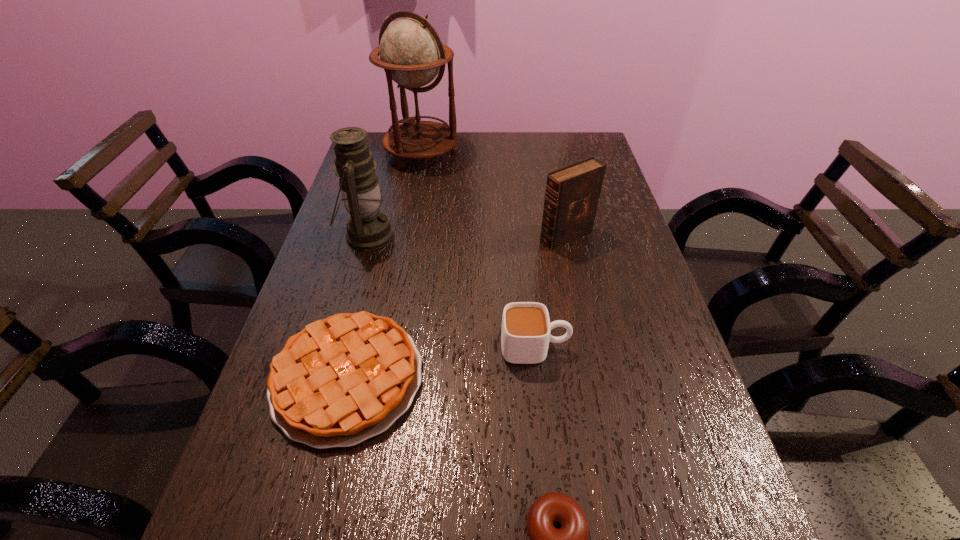
The image size is (960, 540). Find the location of `globe`. globe is located at coordinates (411, 53).

Where is `the farthest object`? the farthest object is located at coordinates (411, 53).

I want to click on the fifth shortest object, so click(368, 228).

Locate an element on the screen. Image resolution: width=960 pixels, height=540 pixels. Bible is located at coordinates (572, 194).

You are a GUI agent. You are given a task and a screenshot of the screen. Output one action in this format:
    pyautogui.click(x=<x>, y=<y>)
    Task: Click on the fourth tallest object
    This screenshot has width=960, height=540.
    Given the screenshot: What is the action you would take?
    pyautogui.click(x=525, y=334)

In order to click on the fifth tallest object in this screenshot , I will do 342,380.

This screenshot has height=540, width=960. Identify the location of vacant region located on the surface of the farthest object. (409, 222).

I want to click on vacant space located on the back of the oil lamp, so click(378, 197).

Locate an element on the screen. vacant space situated 0.330m on the back of the third tallest object is located at coordinates (550, 161).

The image size is (960, 540). In order to click on free space located on the side with the handle of the cup in this screenshot , I will do `click(636, 348)`.